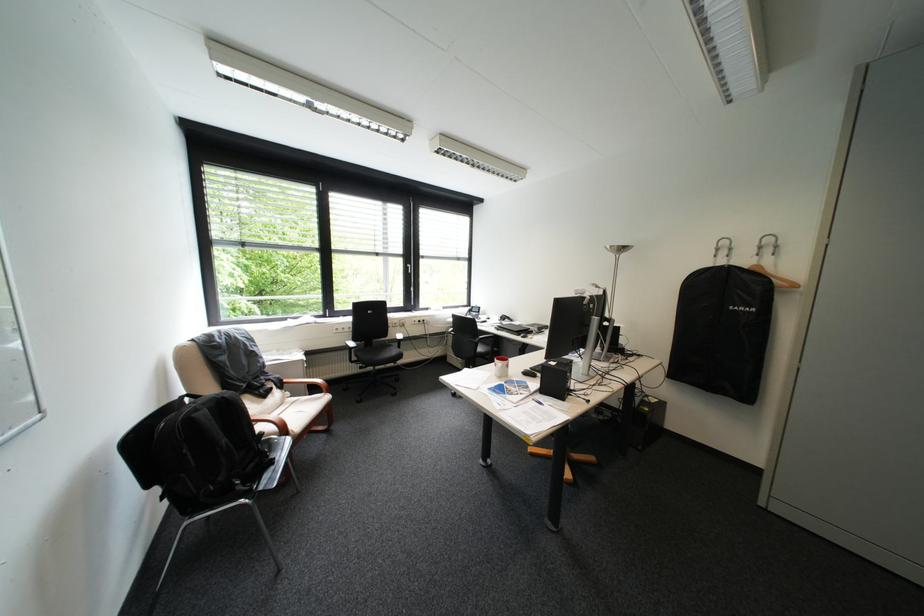
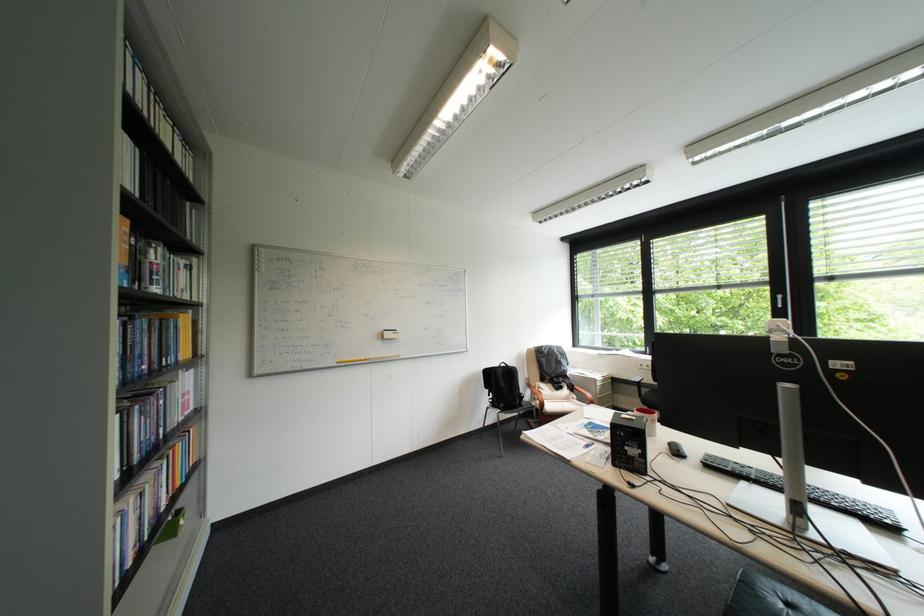
In the second image, find the point that corresponds to point 161,485 in the first image.

(497, 387)